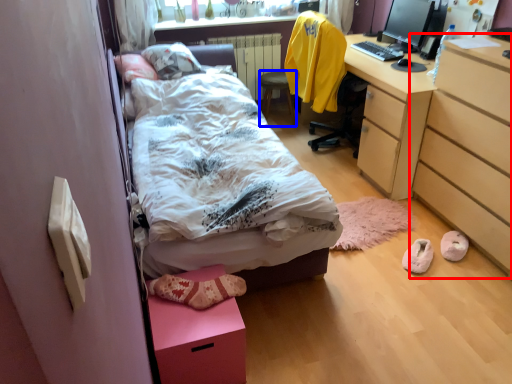
Question: Among these objects, which one is nearest to the camera, chest of drawers (highlighted by a red box) or stool (highlighted by a blue box)?

Choices:
 (A) chest of drawers
 (B) stool

Answer: (A)